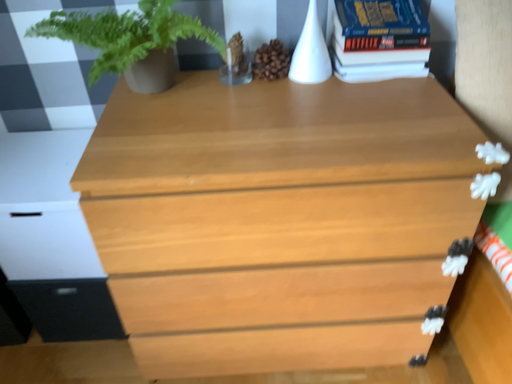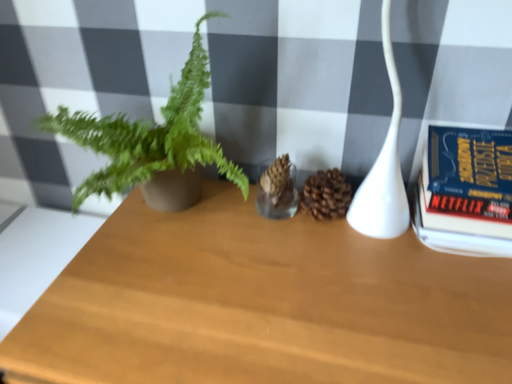
Question: How did the camera likely rotate when shooting the video?

Choices:
 (A) rotated left
 (B) rotated right

Answer: (A)